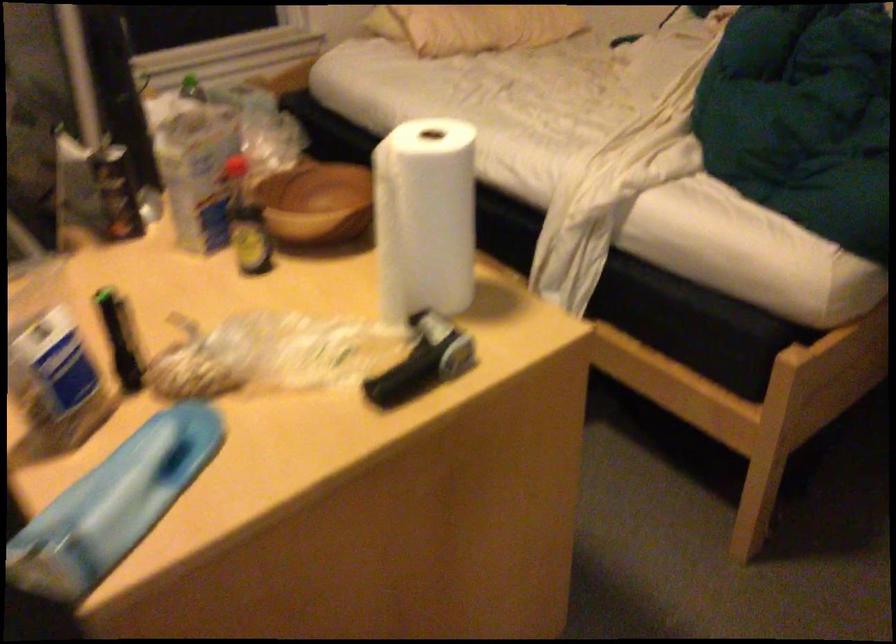
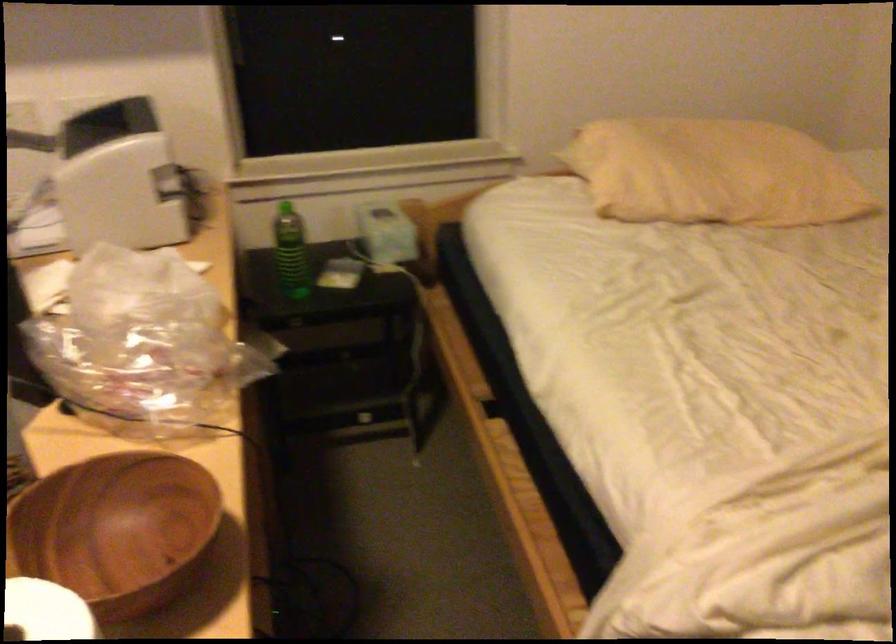
Where in the second image is the point corresponding to point 250,100 from the first image?

(385, 232)